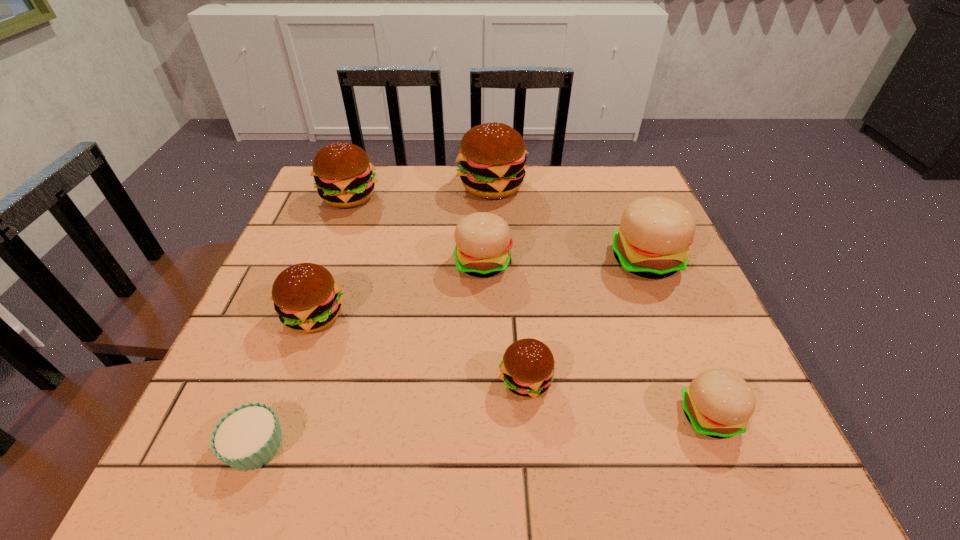
Locate an element on the screen. the tallest hamburger is located at coordinates (492, 157).

Locate an element on the screen. the biggest brown hamburger is located at coordinates (492, 157).

You are a GUI agent. You are given a task and a screenshot of the screen. Output one action in this format:
    pyautogui.click(x=<x>, y=<y>)
    Task: Click on the third smallest brown hamburger
    
    Given the screenshot: What is the action you would take?
    pyautogui.click(x=344, y=176)

At what (x,y) coordinates should I click in order to perform the action: click on the biggest beige hamburger. Please return your answer as a coordinate pair (x, y). The image size is (960, 540). Looking at the image, I should click on (653, 239).

Where is `the third biggest brown hamburger`? The width and height of the screenshot is (960, 540). the third biggest brown hamburger is located at coordinates (307, 299).

Identify the location of the fourth nearest object. This screenshot has height=540, width=960. (307, 299).

This screenshot has height=540, width=960. In order to click on the second smallest beige hamburger in this screenshot , I will do `click(483, 241)`.

The width and height of the screenshot is (960, 540). What are the coordinates of `the nearest brown hamburger` in the screenshot? It's located at (527, 368).

Find the location of a particular element. Image resolution: width=960 pixels, height=540 pixels. the smallest beige hamburger is located at coordinates (718, 403).

Find the location of a particular element. Image resolution: width=960 pixels, height=540 pixels. cupcake is located at coordinates (247, 437).